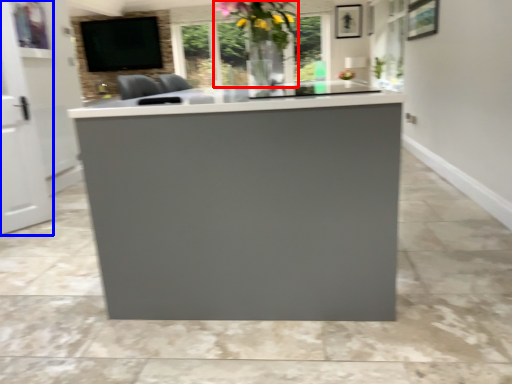
Question: Among these objects, which one is farthest to the camera, floral arrangement (highlighted by a red box) or glass door (highlighted by a blue box)?

Choices:
 (A) floral arrangement
 (B) glass door

Answer: (B)